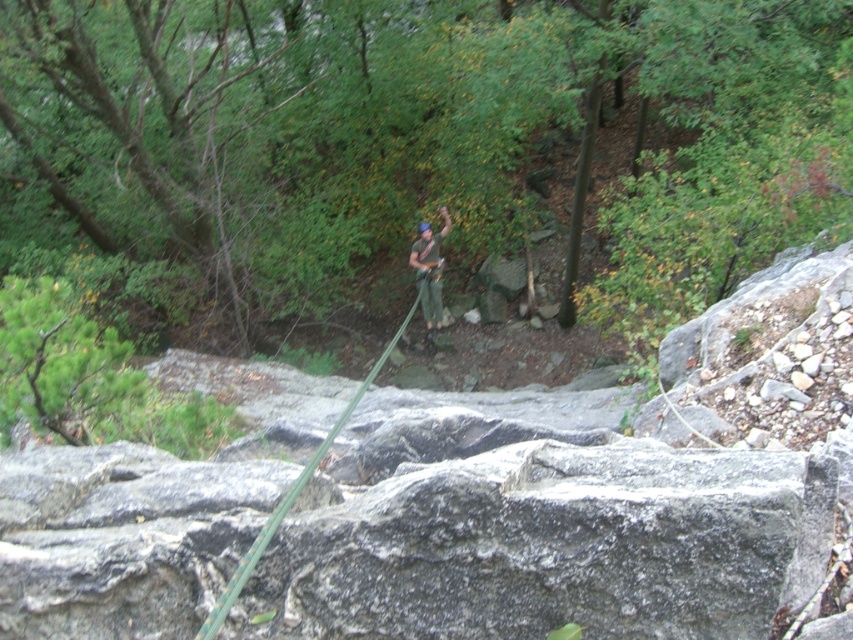
Question: Does green leafy tree at center appear on the left side of green fabric harness at center?

Choices:
 (A) no
 (B) yes

Answer: (A)

Question: Which of the following is the closest to the observer?

Choices:
 (A) green fabric harness at center
 (B) green leafy tree at center

Answer: (B)

Question: Considering the relative positions of green leafy tree at center and green fabric harness at center in the image provided, where is green leafy tree at center located with respect to green fabric harness at center?

Choices:
 (A) right
 (B) left

Answer: (A)

Question: Does green leafy tree at center appear on the left side of green fabric harness at center?

Choices:
 (A) yes
 (B) no

Answer: (B)

Question: Which of the following is the farthest from the observer?

Choices:
 (A) green leafy tree at center
 (B) green fabric harness at center

Answer: (B)